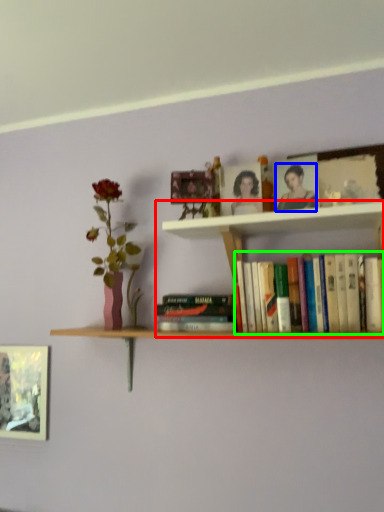
Question: Which is nearer to the cabinet (highlighted by a red box)? person (highlighted by a blue box) or book (highlighted by a green box).

Choices:
 (A) person
 (B) book

Answer: (A)